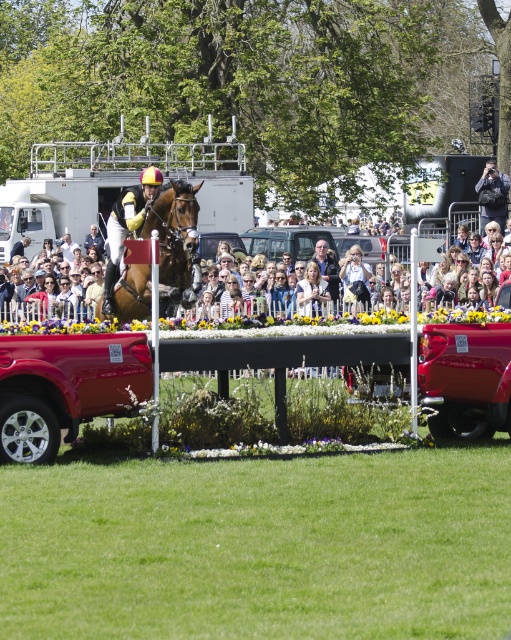
Question: Which point appears farthest from the camera in this image?

Choices:
 (A) pos(355,292)
 (B) pos(385,305)
 (C) pos(297,284)
 (D) pos(191,301)

Answer: (C)

Question: Where is brown glossy horse at center located in relation to light brown leather jacket at center in the image?

Choices:
 (A) left
 (B) right

Answer: (A)

Question: Is brown glossy horse at center above light brown hair at center?

Choices:
 (A) yes
 (B) no

Answer: (A)

Question: Does matte brown horse at center appear on the left side of light brown hair at center?

Choices:
 (A) yes
 (B) no

Answer: (A)

Question: Which of the following is the farthest from the observer?

Choices:
 (A) light brown leather jacket at center
 (B) brown glossy horse at center
 (C) matte brown horse at center

Answer: (A)

Question: Which point appears farthest from the camera in this image?

Choices:
 (A) (266, 317)
 (B) (175, 294)
 (C) (319, 282)

Answer: (C)